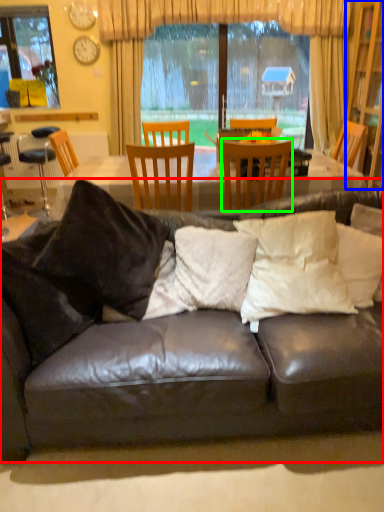
Question: Which object is the farthest from studio couch (highlighted by a red box)? Choose among these: cabinetry (highlighted by a blue box) or chair (highlighted by a green box).

Choices:
 (A) cabinetry
 (B) chair

Answer: (A)